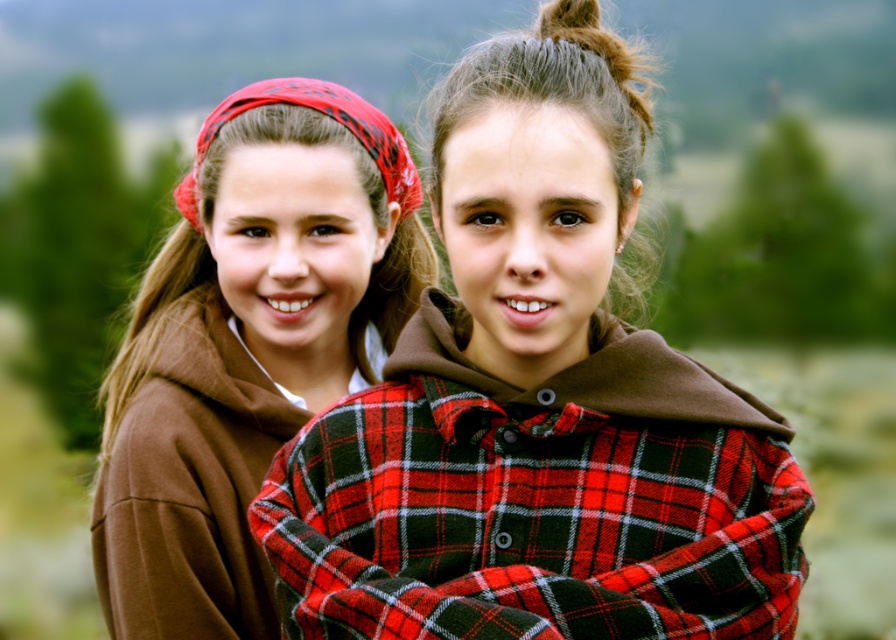
You are a GUI agent. You are given a task and a screenshot of the screen. Output one action in this format:
    pyautogui.click(x=<x>, y=<y>)
    Task: Click on the red plaid shirt at center
    The height and width of the screenshot is (640, 896).
    Given the screenshot: What is the action you would take?
    pyautogui.click(x=537, y=403)

Who is higher up, red plaid shirt at center or red plaid bandana at upper left?

red plaid bandana at upper left is higher up.

Between point (669, 600) and point (389, 134), which one is positioned in front?

Point (669, 600) is more forward.

Identify the location of red plaid shirt at center. The width and height of the screenshot is (896, 640). pos(537,403).

Does red plaid shirt at center have a greater height compared to matte brown hoodie at left?

No.

How far apart are red plaid shirt at center and matte brown hoodie at left?

1.01 meters

Does point (548, 202) lie behind point (303, 161)?

No.

This screenshot has width=896, height=640. I want to click on red plaid shirt at center, so click(x=537, y=403).

Can you confirm if matte brown hair at center is positioned to the right of red plaid bandana at upper left?

Correct, you'll find matte brown hair at center to the right of red plaid bandana at upper left.

Based on the photo, is matte brown hair at center positioned before red plaid bandana at upper left?

Yes.

Locate an element on the screen. matte brown hair at center is located at coordinates (552, 86).